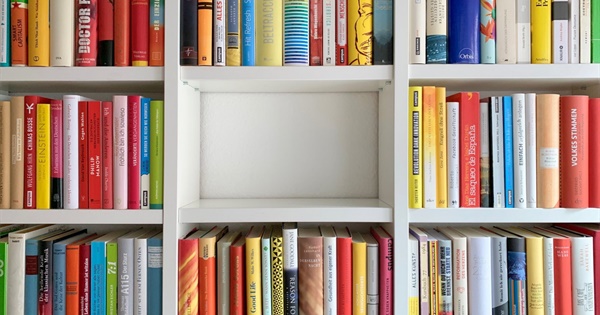
Locate an element on the screen. white shelves is located at coordinates (95, 76), (239, 74), (466, 73), (474, 221), (296, 216), (110, 211), (168, 156), (402, 152).